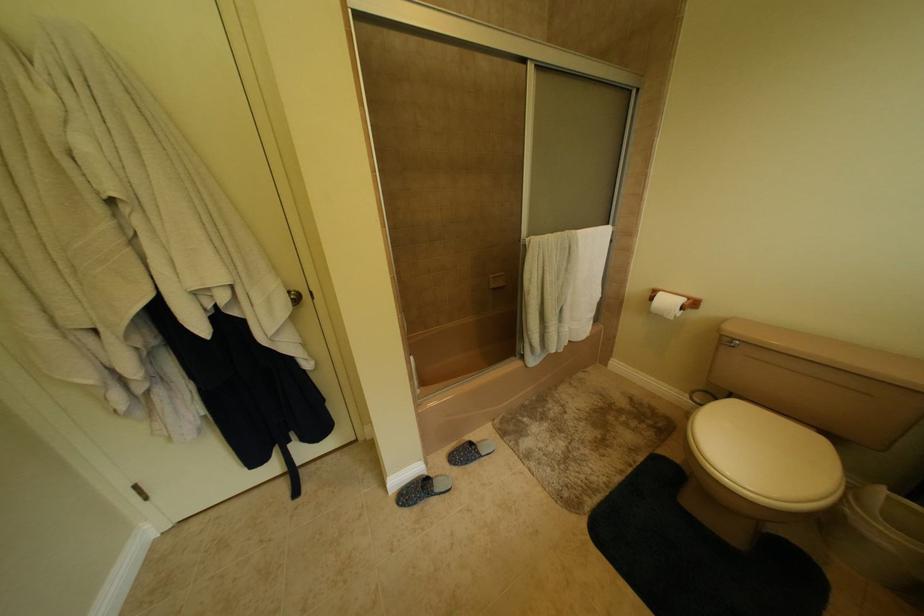
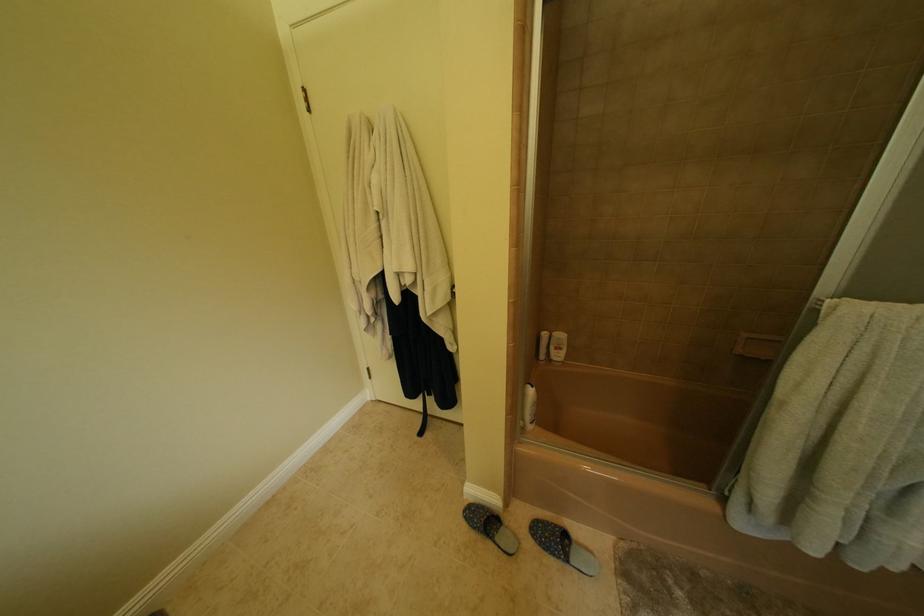
Question: The first image is from the beginning of the video and the second image is from the end. How did the camera likely rotate when shooting the video?

Choices:
 (A) Left
 (B) Right
 (C) Up
 (D) Down

Answer: (A)